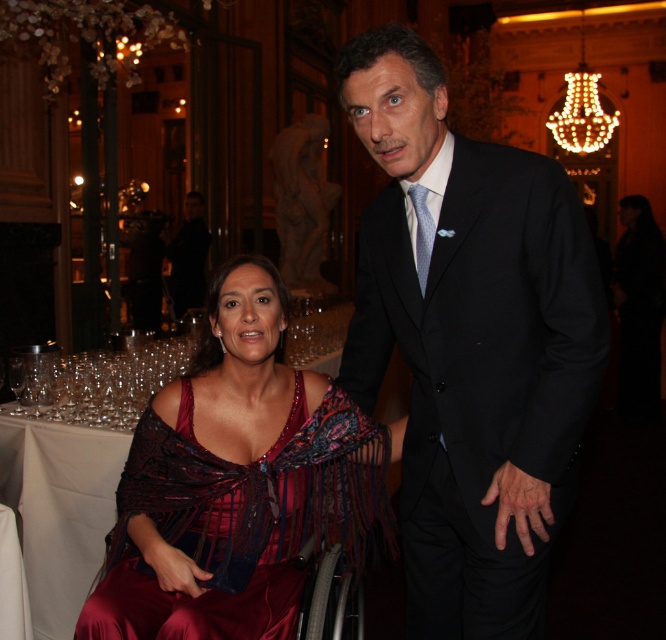
Question: Which object is farther from the camera taking this photo?

Choices:
 (A) black silk suit at center
 (B) burgundy satin dress at center

Answer: (B)

Question: Is black silk suit at center positioned at the back of burgundy satin dress at center?

Choices:
 (A) yes
 (B) no

Answer: (B)

Question: Which of the following is the closest to the observer?

Choices:
 (A) burgundy satin dress at center
 (B) black silk suit at center

Answer: (B)

Question: Is black silk suit at center in front of burgundy satin dress at center?

Choices:
 (A) yes
 (B) no

Answer: (A)

Question: Is the position of black silk suit at center more distant than that of burgundy satin dress at center?

Choices:
 (A) no
 (B) yes

Answer: (A)